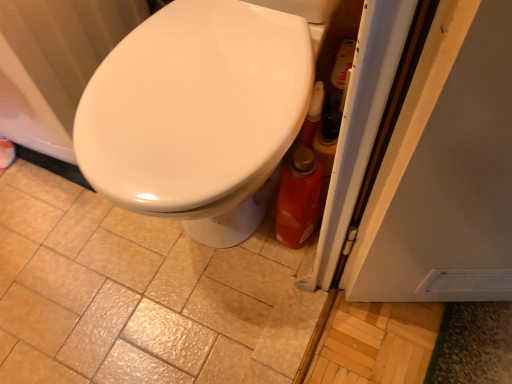
Question: Is white glossy radiator at upper left facing towards white glossy bidet at center?

Choices:
 (A) yes
 (B) no

Answer: (B)

Question: Are white glossy radiator at upper left and white glossy bidet at center located far from each other?

Choices:
 (A) yes
 (B) no

Answer: (B)

Question: From the image's perspective, is white glossy radiator at upper left on white glossy bidet at center?

Choices:
 (A) no
 (B) yes

Answer: (B)

Question: Does white glossy radiator at upper left have a greater width compared to white glossy bidet at center?

Choices:
 (A) yes
 (B) no

Answer: (B)

Question: From a real-world perspective, is white glossy radiator at upper left physically below white glossy bidet at center?

Choices:
 (A) no
 (B) yes

Answer: (B)

Question: From a real-world perspective, relative to white glossy radiator at upper left, is white glossy bidet at center vertically above or below?

Choices:
 (A) below
 (B) above

Answer: (B)

Question: Considering the positions of point (194, 3) and point (8, 9), is point (194, 3) closer or farther from the camera than point (8, 9)?

Choices:
 (A) farther
 (B) closer

Answer: (A)

Question: In terms of height, does white glossy bidet at center look taller or shorter compared to white glossy radiator at upper left?

Choices:
 (A) tall
 (B) short

Answer: (A)

Question: Is white glossy bidet at center in front of or behind white glossy radiator at upper left in the image?

Choices:
 (A) front
 (B) behind

Answer: (A)

Question: Is matte ceramic tile at center situated inside white glossy radiator at upper left or outside?

Choices:
 (A) inside
 (B) outside

Answer: (B)

Question: Is matte ceramic tile at center taller or shorter than white glossy radiator at upper left?

Choices:
 (A) short
 (B) tall

Answer: (A)

Question: From a real-world perspective, is matte ceramic tile at center positioned above or below white glossy radiator at upper left?

Choices:
 (A) below
 (B) above

Answer: (A)

Question: Is point (119, 314) positioned closer to the camera than point (3, 87)?

Choices:
 (A) farther
 (B) closer

Answer: (A)

Question: Looking at the image, does white glossy radiator at upper left seem bigger or smaller compared to matte ceramic tile at center?

Choices:
 (A) big
 (B) small

Answer: (A)

Question: From the image's perspective, is white glossy radiator at upper left located above or below matte ceramic tile at center?

Choices:
 (A) above
 (B) below

Answer: (A)